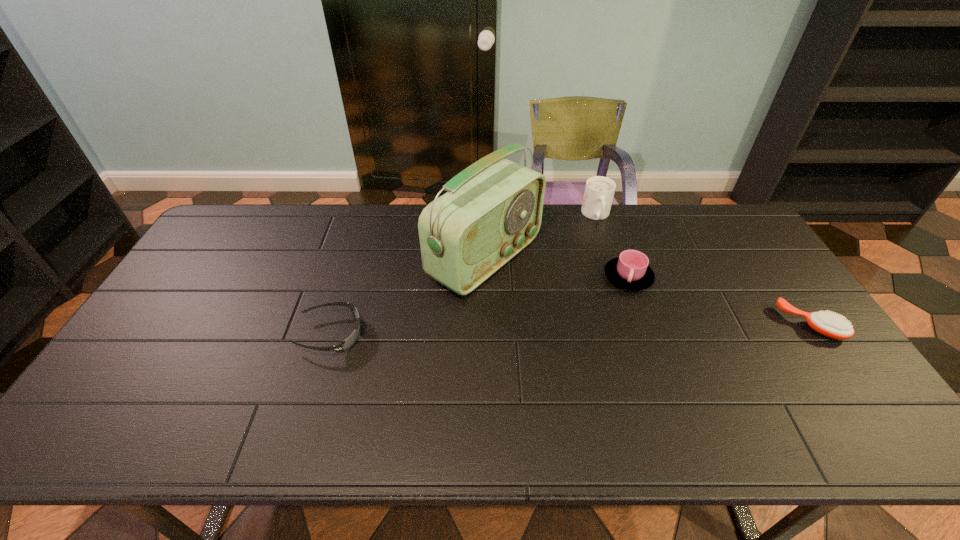
Where is `sunglasses`? This screenshot has width=960, height=540. sunglasses is located at coordinates (344, 345).

In order to click on the rightmost object in this screenshot , I will do `click(829, 324)`.

The width and height of the screenshot is (960, 540). What are the coordinates of `radio receiver` in the screenshot? It's located at click(x=492, y=210).

Where is `the tallest object`? The image size is (960, 540). the tallest object is located at coordinates (492, 210).

Find the location of a particular element. the third shortest object is located at coordinates point(630,271).

Find the location of a particular element. cappuccino is located at coordinates (599, 191).

This screenshot has width=960, height=540. Identify the location of vacant area situated on the lenses of the leftmost object. (492, 335).

Image resolution: width=960 pixels, height=540 pixels. In order to click on vacant area situated 0.130m on the back of the hairbrush in this screenshot , I will do `click(776, 274)`.

Find the location of a particular element. free spot located 0.050m on the front panel of the second object from left to right is located at coordinates (x=546, y=295).

Identify the location of free location located on the front panel of the second object from left to right. (600, 326).